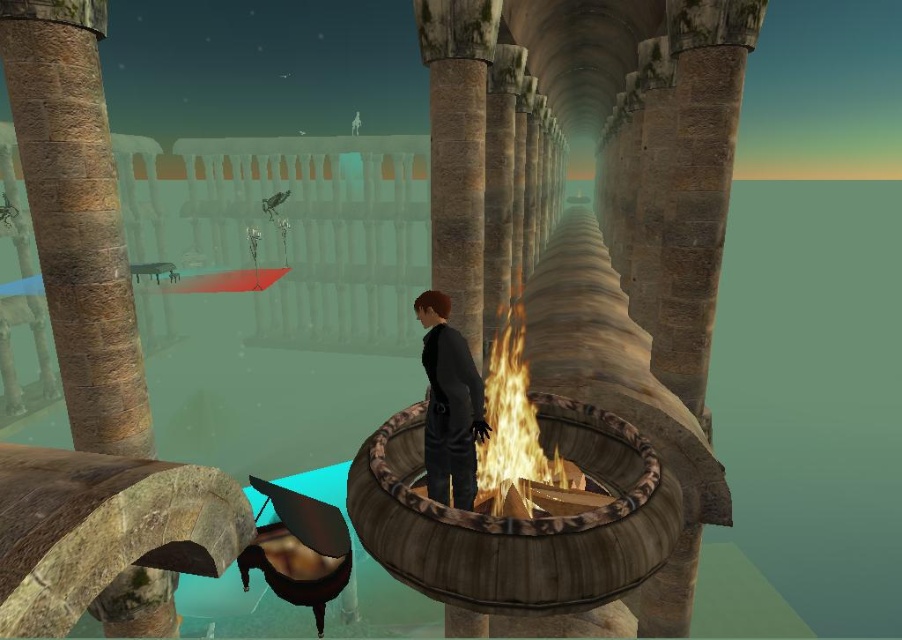
Between brown stone pillar at left and rustic wood fire pit at center, which one appears on the right side from the viewer's perspective?

From the viewer's perspective, rustic wood fire pit at center appears more on the right side.

In the scene shown: Can you confirm if brown stone pillar at left is smaller than rustic wood fire pit at center?

No.

What are the coordinates of `brown stone pillar at left` in the screenshot? It's located at (77, 216).

Locate an element on the screen. rustic wood fire pit at center is located at coordinates (518, 518).

Does point (531, 547) come closer to viewer compared to point (475, 392)?

Yes, it is in front of point (475, 392).

Find the location of a particular element. rustic wood fire pit at center is located at coordinates (518, 518).

Is rustic wood fire pit at center below flamewooden" at "center?

Yes.

Does rustic wood fire pit at center have a greater height compared to flamewooden" at "center?

Yes, rustic wood fire pit at center is taller than flamewooden" at "center.

Between point (624, 529) and point (492, 381), which one is positioned in front?

Point (624, 529) is in front.

In order to click on rustic wood fire pit at center in this screenshot , I will do `click(518, 518)`.